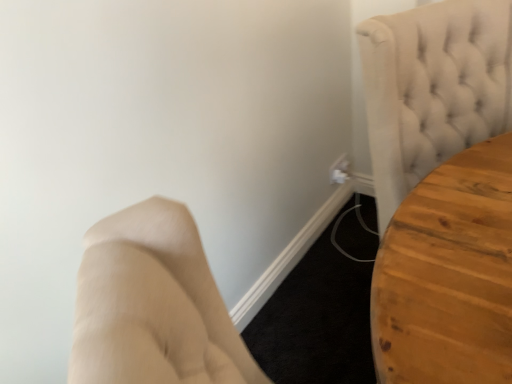
Find the location of a particular element. wooden table at right is located at coordinates (448, 275).

What do you see at coordinates (448, 275) in the screenshot?
I see `wooden table at right` at bounding box center [448, 275].

The image size is (512, 384). Find the location of `wooden table at right`. wooden table at right is located at coordinates (448, 275).